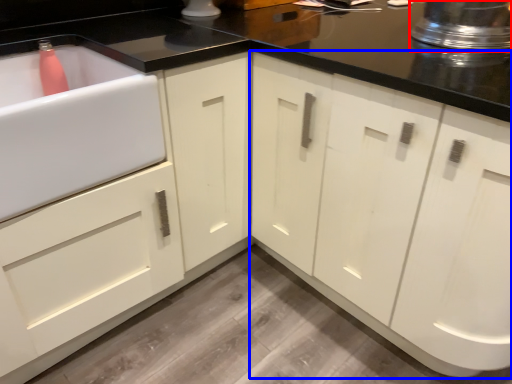
Question: Which object is further to the camera taking this photo, appliance (highlighted by a red box) or cabinetry (highlighted by a blue box)?

Choices:
 (A) appliance
 (B) cabinetry

Answer: (A)